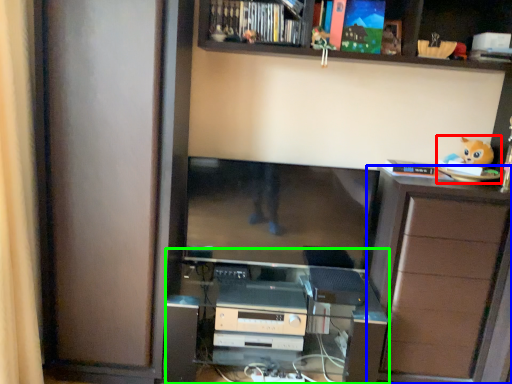
Question: Which is farther away from toy (highlighted by a red box)? cabinetry (highlighted by a blue box) or entertainment center (highlighted by a green box)?

Choices:
 (A) cabinetry
 (B) entertainment center

Answer: (B)